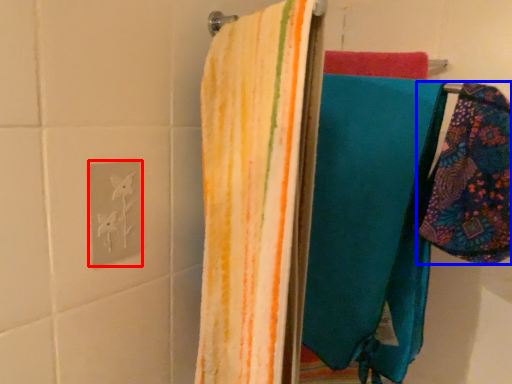
Question: Which object appears closest to the camera in this image, electric outlet (highlighted by a red box) or towel (highlighted by a blue box)?

Choices:
 (A) electric outlet
 (B) towel

Answer: (B)